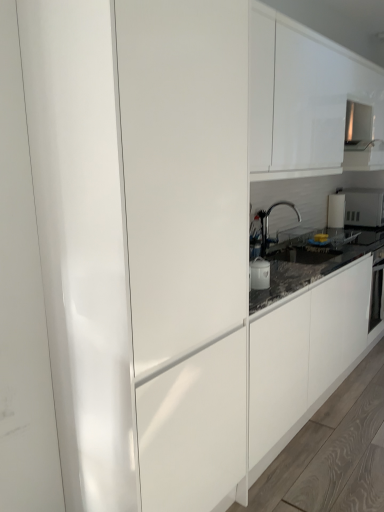
Question: Does white glossy microwave at upper right, which ranks as the 2th appliance in bottom-to-top order, lie behind matte white cabinet at center?

Choices:
 (A) no
 (B) yes

Answer: (B)

Question: From the image's perspective, is white glossy microwave at upper right, the 1th appliance viewed from the back, on matte white cabinet at center?

Choices:
 (A) no
 (B) yes

Answer: (B)

Question: Is white glossy microwave at upper right, marked as the 2th appliance in a left-to-right arrangement, bigger than matte white cabinet at center?

Choices:
 (A) yes
 (B) no

Answer: (B)

Question: Is white glossy microwave at upper right, arranged as the 2th appliance when viewed from the front, not near matte white cabinet at center?

Choices:
 (A) yes
 (B) no

Answer: (A)

Question: Can matte white cabinet at center be found inside white glossy microwave at upper right, arranged as the 2th appliance when viewed from the front?

Choices:
 (A) yes
 (B) no

Answer: (B)

Question: Is white glossy cabinet at upper center taller or shorter than white glossy microwave at upper right, marked as the 2th appliance in a left-to-right arrangement?

Choices:
 (A) tall
 (B) short

Answer: (A)

Question: In terms of size, does white glossy cabinet at upper center appear bigger or smaller than white glossy microwave at upper right, which ranks as the 2th appliance in bottom-to-top order?

Choices:
 (A) small
 (B) big

Answer: (B)

Question: Is white glossy cabinet at upper center to the left or to the right of white glossy microwave at upper right, the 1th appliance viewed from the back, in the image?

Choices:
 (A) right
 (B) left

Answer: (B)

Question: From a real-world perspective, is white glossy cabinet at upper center positioned above or below white glossy microwave at upper right, marked as the 2th appliance in a left-to-right arrangement?

Choices:
 (A) below
 (B) above

Answer: (B)

Question: Do you think white glossy pot at center, which is the 2th appliance from right to left, is within satin nickel faucet at center, or outside of it?

Choices:
 (A) inside
 (B) outside

Answer: (B)

Question: Is white glossy pot at center, placed as the 2th appliance when sorted from top to bottom, bigger or smaller than satin nickel faucet at center?

Choices:
 (A) small
 (B) big

Answer: (A)

Question: Visually, is white glossy pot at center, arranged as the 1th appliance when ordered from the bottom, positioned to the left or to the right of satin nickel faucet at center?

Choices:
 (A) right
 (B) left

Answer: (B)

Question: In terms of height, does white glossy pot at center, marked as the 1th appliance in a left-to-right arrangement, look taller or shorter compared to satin nickel faucet at center?

Choices:
 (A) short
 (B) tall

Answer: (A)

Question: Considering the positions of point coord(168,366) and point coord(259,263), is point coord(168,366) closer or farther from the camera than point coord(259,263)?

Choices:
 (A) closer
 (B) farther

Answer: (A)

Question: In terms of width, does matte white cabinet at center look wider or thinner when compared to white glossy pot at center, placed as the 2th appliance when sorted from top to bottom?

Choices:
 (A) wide
 (B) thin

Answer: (A)